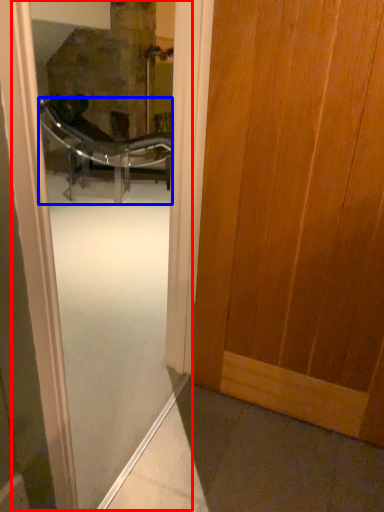
Question: Which point is further to the camera, screen door (highlighted by a red box) or chair (highlighted by a blue box)?

Choices:
 (A) screen door
 (B) chair

Answer: (B)